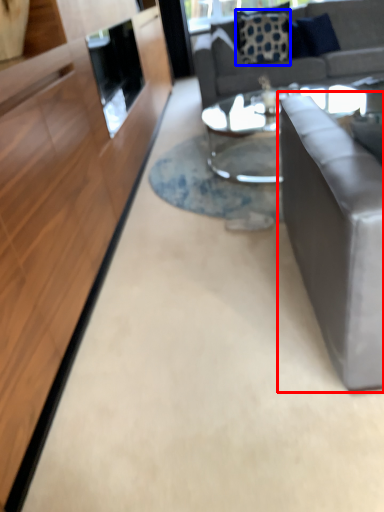
Question: Among these objects, which one is farthest to the camera, studio couch (highlighted by a red box) or pillow (highlighted by a blue box)?

Choices:
 (A) studio couch
 (B) pillow

Answer: (B)